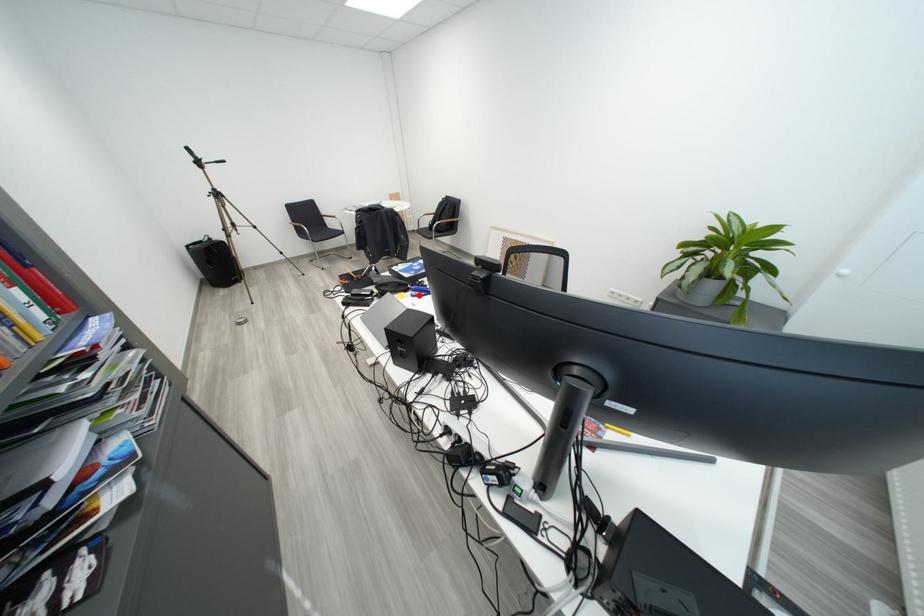
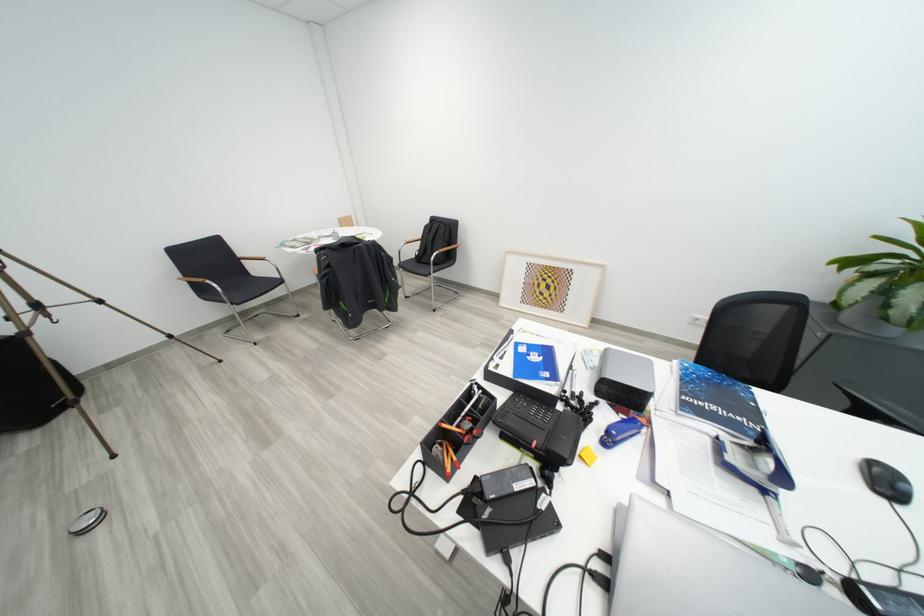
Find the pixel in the second image that matches the highlighted location in the first image.

(600, 438)